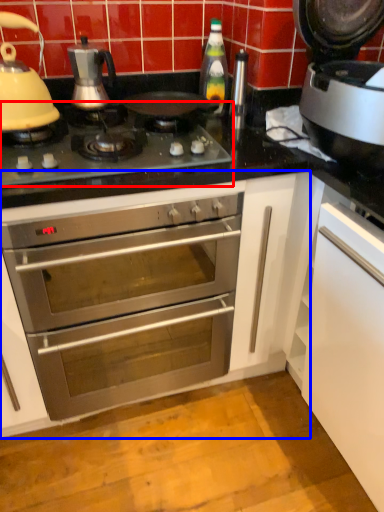
Question: Which object appears farthest to the camera in this image, gas stove (highlighted by a red box) or cabinetry (highlighted by a blue box)?

Choices:
 (A) gas stove
 (B) cabinetry

Answer: (A)